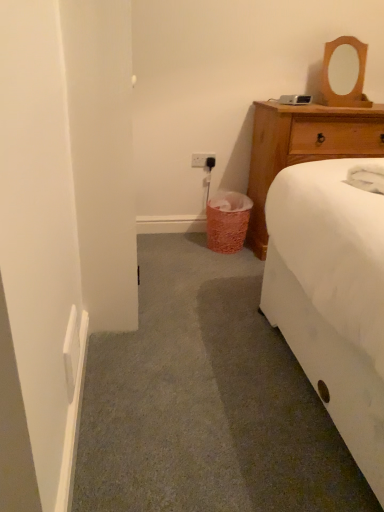
Question: From a real-world perspective, is wooden mirror at upper right physically below wooden dresser at upper right?

Choices:
 (A) yes
 (B) no

Answer: (B)

Question: Does wooden mirror at upper right appear on the left side of wooden dresser at upper right?

Choices:
 (A) no
 (B) yes

Answer: (A)

Question: Could wooden dresser at upper right be considered to be inside wooden mirror at upper right?

Choices:
 (A) no
 (B) yes

Answer: (A)

Question: Considering the relative positions of wooden mirror at upper right and wooden dresser at upper right in the image provided, is wooden mirror at upper right to the right of wooden dresser at upper right from the viewer's perspective?

Choices:
 (A) yes
 (B) no

Answer: (A)

Question: Can you confirm if wooden mirror at upper right is shorter than wooden dresser at upper right?

Choices:
 (A) yes
 (B) no

Answer: (A)

Question: In the image, is pink textured trash can at lower center positioned in front of or behind wooden dresser at upper right?

Choices:
 (A) front
 (B) behind

Answer: (B)

Question: From the image's perspective, relative to wooden dresser at upper right, is pink textured trash can at lower center above or below?

Choices:
 (A) below
 (B) above

Answer: (A)

Question: Is pink textured trash can at lower center to the left or to the right of wooden dresser at upper right in the image?

Choices:
 (A) left
 (B) right

Answer: (A)

Question: Is point (218, 212) closer or farther from the camera than point (331, 110)?

Choices:
 (A) farther
 (B) closer

Answer: (A)

Question: Looking at the image, does wooden dresser at upper right seem bigger or smaller compared to wooden mirror at upper right?

Choices:
 (A) big
 (B) small

Answer: (A)

Question: Is wooden dresser at upper right inside the boundaries of wooden mirror at upper right, or outside?

Choices:
 (A) inside
 (B) outside

Answer: (B)

Question: Is wooden dresser at upper right taller or shorter than wooden mirror at upper right?

Choices:
 (A) tall
 (B) short

Answer: (A)

Question: Based on their positions, is wooden dresser at upper right located to the left or right of wooden mirror at upper right?

Choices:
 (A) left
 (B) right

Answer: (A)

Question: Relative to wooden mirror at upper right, is white plastic power outlet at center in front or behind?

Choices:
 (A) front
 (B) behind

Answer: (B)

Question: From the image's perspective, relative to wooden mirror at upper right, is white plastic power outlet at center above or below?

Choices:
 (A) below
 (B) above

Answer: (A)